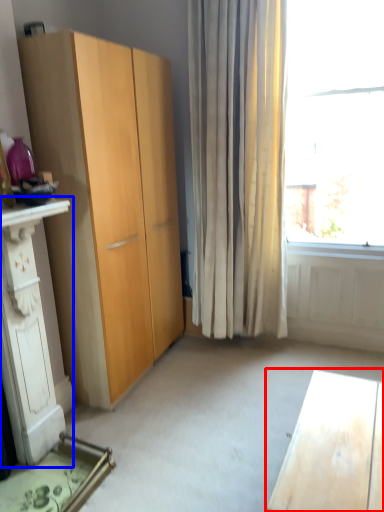
Question: Which object appears closest to the camera in this image, desk (highlighted by a red box) or dresser (highlighted by a blue box)?

Choices:
 (A) desk
 (B) dresser

Answer: (A)